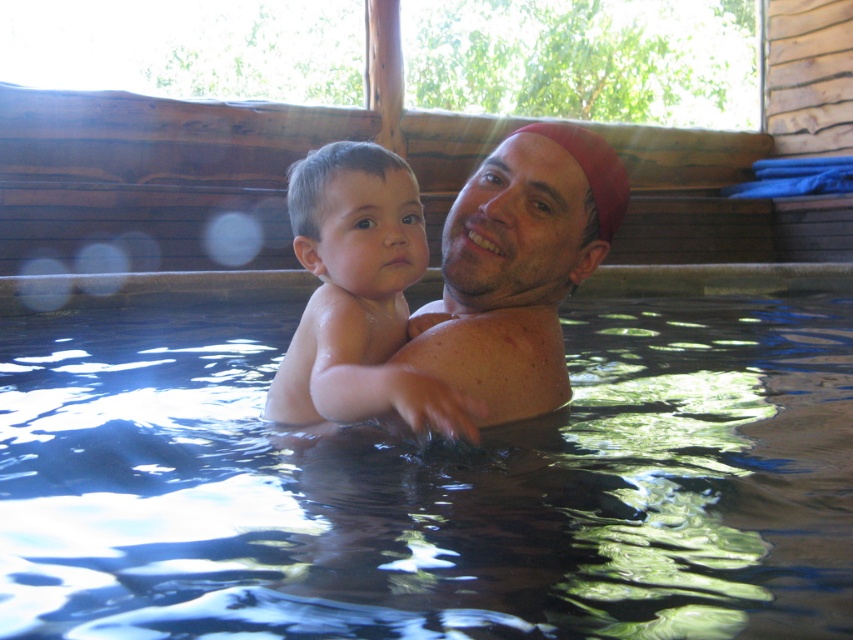
Question: Is transparent water at center bigger than matte skin at center?

Choices:
 (A) no
 (B) yes

Answer: (B)

Question: Is transparent water at center thinner than smooth skin baby at center?

Choices:
 (A) yes
 (B) no

Answer: (B)

Question: Which point is closer to the camera?

Choices:
 (A) (547, 308)
 (B) (312, 172)
 (C) (828, 621)

Answer: (C)

Question: Which point is farther from the camera taking this photo?

Choices:
 (A) (401, 388)
 (B) (459, 243)

Answer: (B)

Question: Estimate the real-world distances between objects in this image. Which object is farther from the smooth skin baby at center?

Choices:
 (A) matte skin at center
 (B) transparent water at center

Answer: (B)

Question: Can you confirm if transparent water at center is smaller than matte skin at center?

Choices:
 (A) yes
 (B) no

Answer: (B)